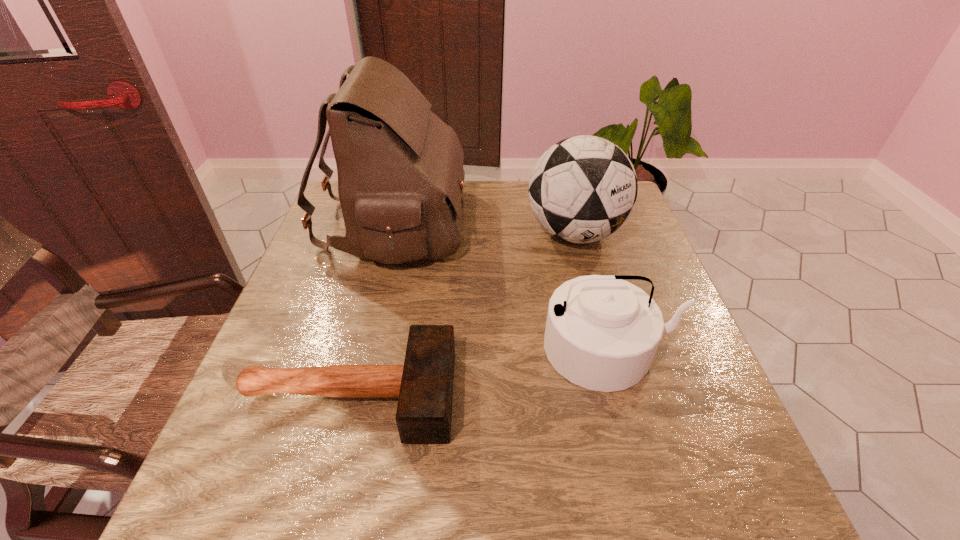
This screenshot has height=540, width=960. What are the coordinates of `vacant region at the far left corner of the desktop` in the screenshot? It's located at (335, 193).

This screenshot has height=540, width=960. I want to click on free space at the near left corner of the desktop, so click(x=277, y=483).

This screenshot has width=960, height=540. I want to click on vacant space at the near right corner of the desktop, so click(755, 482).

This screenshot has width=960, height=540. I want to click on free space between the mallet and the soccer ball, so click(x=463, y=314).

The height and width of the screenshot is (540, 960). In order to click on free spot between the shortest object and the satchel in this screenshot , I will do `click(372, 309)`.

The height and width of the screenshot is (540, 960). What are the coordinates of `free spot between the shortest object and the satchel` in the screenshot? It's located at (372, 309).

Locate an element on the screen. Image resolution: width=960 pixels, height=540 pixels. vacant space that's between the tallest object and the soccer ball is located at coordinates point(484,229).

Find the location of `free point between the shortest object and the tallest object`. free point between the shortest object and the tallest object is located at coordinates 372,309.

Where is `free area in between the tallest object and the mallet`? free area in between the tallest object and the mallet is located at coordinates (372, 309).

Where is `unoccupied position between the kettle and the tallest object`? Image resolution: width=960 pixels, height=540 pixels. unoccupied position between the kettle and the tallest object is located at coordinates (501, 286).